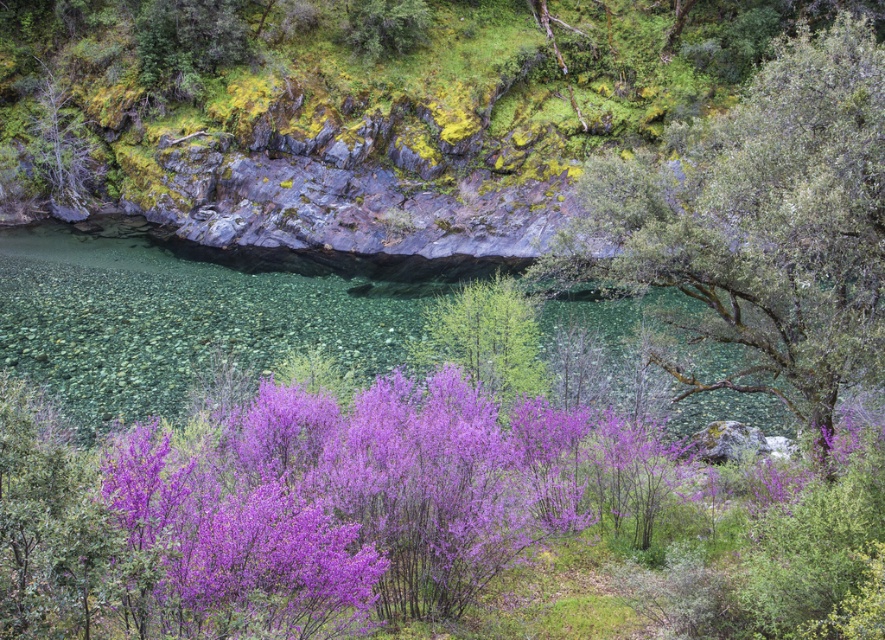
Question: Among these objects, which one is farthest from the camera?

Choices:
 (A) purple matte flowers at center
 (B) green leafy tree at upper right

Answer: (B)

Question: Does purple matte flowers at center appear on the left side of green leafy tree at upper right?

Choices:
 (A) no
 (B) yes

Answer: (B)

Question: Observing the image, what is the correct spatial positioning of purple matte flowers at center in reference to green leafy tree at upper right?

Choices:
 (A) above
 (B) below

Answer: (B)

Question: Does purple matte flowers at center lie behind green leafy tree at upper right?

Choices:
 (A) yes
 (B) no

Answer: (B)

Question: Among these objects, which one is nearest to the camera?

Choices:
 (A) purple matte flowers at center
 (B) green leafy tree at upper right

Answer: (A)